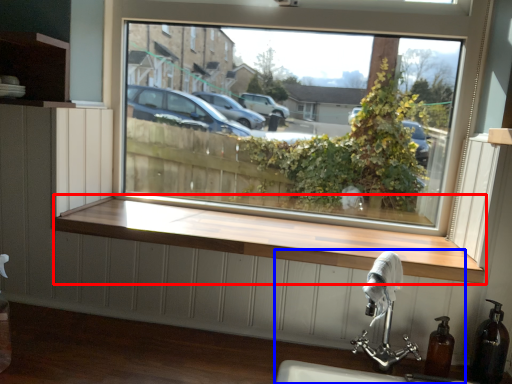
Question: Among these objects, which one is farthest to the camera, window sill (highlighted by a red box) or sink (highlighted by a blue box)?

Choices:
 (A) window sill
 (B) sink

Answer: (A)